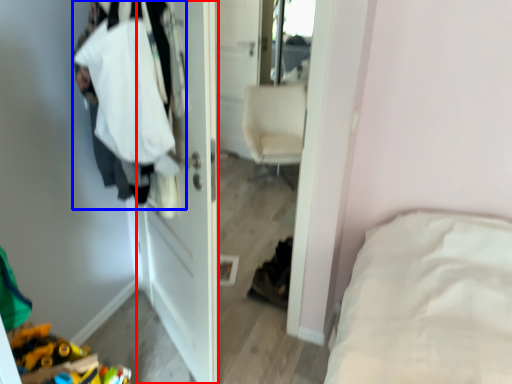
Question: Among these objects, which one is farthest to the camera, door (highlighted by a red box) or clothing (highlighted by a blue box)?

Choices:
 (A) door
 (B) clothing

Answer: (A)